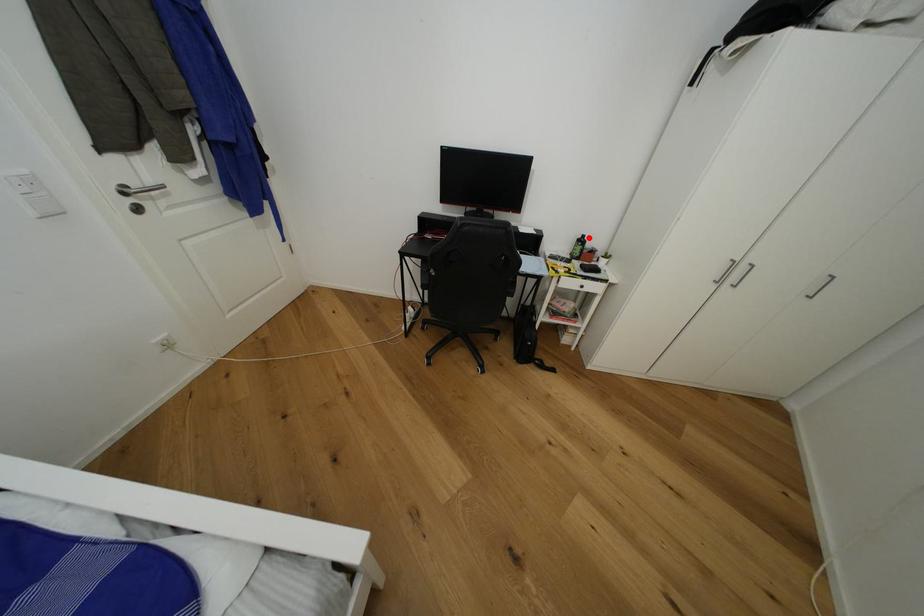
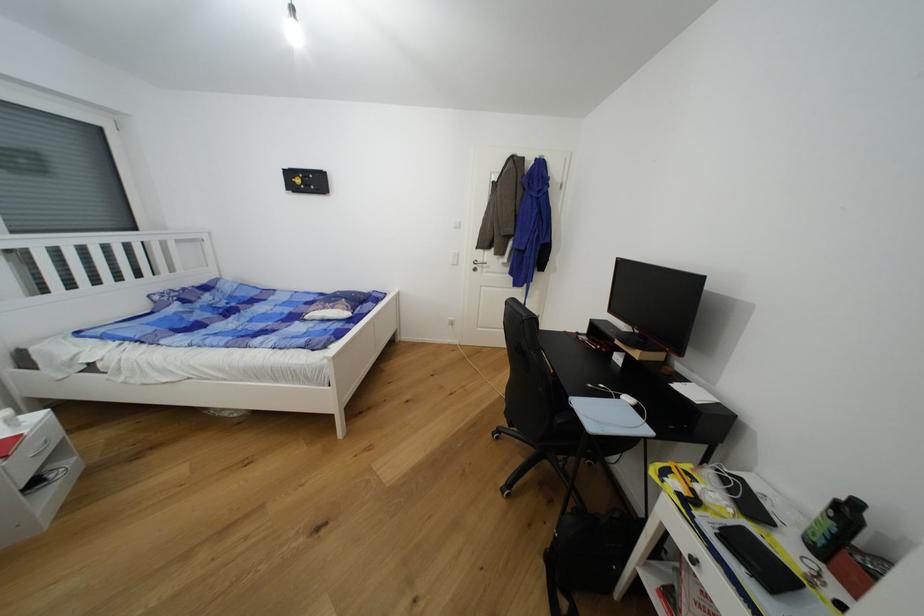
Question: I am providing you with two images of the same scene from different viewpoints. Image1 has a red point marked. In image2, the corresponding 3D location appears at what relative position? Reply with the corresponding letter.

Choices:
 (A) Closer
 (B) Farther

Answer: (B)